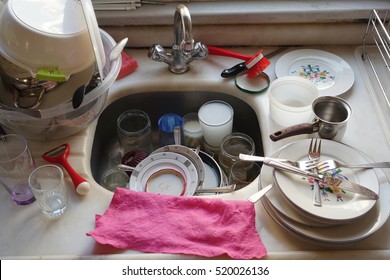
Locate an element on the screen. plate is located at coordinates (310, 66).